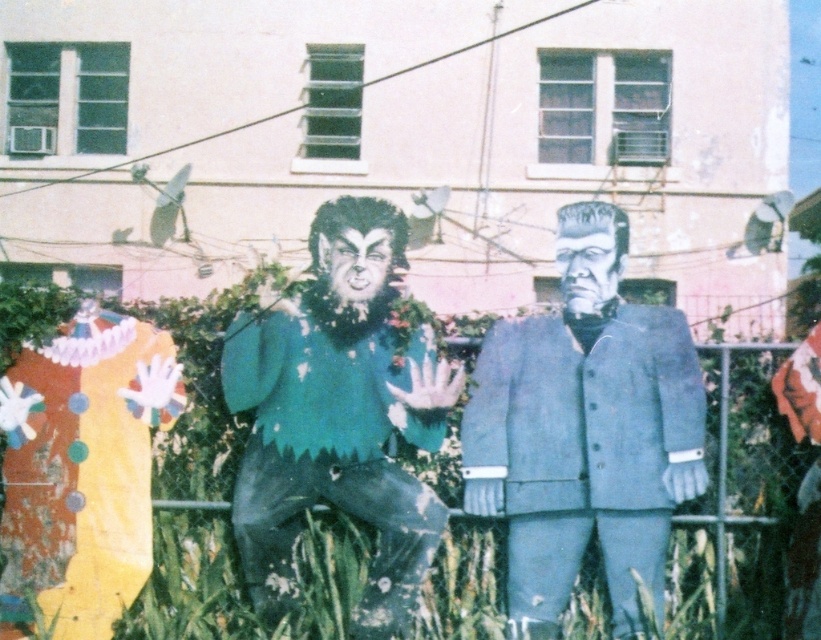
Question: Does metal chain-link fence at center appear on the right side of green matte suit at center?

Choices:
 (A) no
 (B) yes

Answer: (A)

Question: Estimate the real-world distances between objects in this image. Which object is closer to the metal chain-link fence at center?

Choices:
 (A) matte blue suit at center
 (B) green matte suit at center

Answer: (B)

Question: Does metal chain-link fence at center have a smaller size compared to matte blue suit at center?

Choices:
 (A) yes
 (B) no

Answer: (B)

Question: Which point is closer to the camera?

Choices:
 (A) metal chain-link fence at center
 (B) matte blue suit at center
 (C) green matte suit at center

Answer: (B)

Question: Which of these objects is positioned farthest from the matte blue suit at center?

Choices:
 (A) metal chain-link fence at center
 (B) green matte suit at center

Answer: (A)

Question: Observing the image, what is the correct spatial positioning of metal chain-link fence at center in reference to matte blue suit at center?

Choices:
 (A) below
 (B) above

Answer: (A)